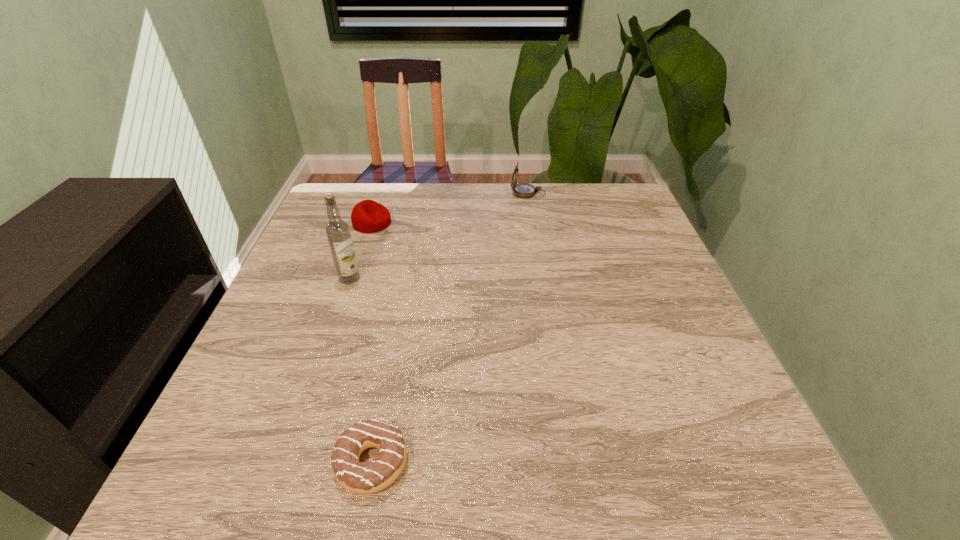
The height and width of the screenshot is (540, 960). I want to click on free space located 0.150m on the face of the farthest object, so click(x=462, y=193).

Where is `vacant space located on the face of the farthest object`? This screenshot has width=960, height=540. vacant space located on the face of the farthest object is located at coordinates (462, 193).

At what (x,y) coordinates should I click in order to perform the action: click on vacant space located 0.210m on the seat area of the beanbag. Please return your answer as a coordinate pair (x, y). This screenshot has width=960, height=540. Looking at the image, I should click on (467, 223).

Where is `free space located on the right of the third object from left to right`? free space located on the right of the third object from left to right is located at coordinates (439, 462).

Find the location of `compass situated at the far edge`. compass situated at the far edge is located at coordinates (523, 190).

The height and width of the screenshot is (540, 960). I want to click on beanbag present at the far edge, so click(x=368, y=216).

This screenshot has height=540, width=960. Find the location of `object that is positioned at the near edge`. object that is positioned at the near edge is located at coordinates (357, 477).

Where is `vodka that is at the left edge`? The height and width of the screenshot is (540, 960). vodka that is at the left edge is located at coordinates (337, 230).

Find the location of `beanbag that is positioned at the left edge`. beanbag that is positioned at the left edge is located at coordinates (368, 216).

The height and width of the screenshot is (540, 960). I want to click on object present at the far left corner, so click(x=368, y=216).